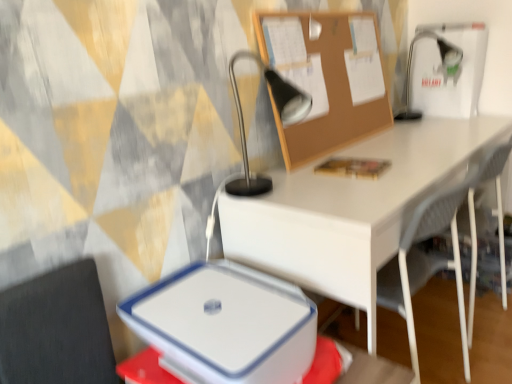
Question: Is the position of metallic silver table lamp at upper center, acting as the 1th table lamp starting from the front, less distant than that of white plastic lunch box at lower center?

Choices:
 (A) yes
 (B) no

Answer: (B)

Question: From the image's perspective, is metallic silver table lamp at upper center, acting as the 1th table lamp starting from the front, over white plastic lunch box at lower center?

Choices:
 (A) no
 (B) yes

Answer: (B)

Question: From the image's perspective, is metallic silver table lamp at upper center, the 2th table lamp in the right-to-left sequence, beneath white plastic lunch box at lower center?

Choices:
 (A) no
 (B) yes

Answer: (A)

Question: From a real-world perspective, is metallic silver table lamp at upper center, which is the 2th table lamp in back-to-front order, physically below white plastic lunch box at lower center?

Choices:
 (A) yes
 (B) no

Answer: (B)

Question: Does metallic silver table lamp at upper center, which is the 2th table lamp in back-to-front order, come behind white plastic lunch box at lower center?

Choices:
 (A) no
 (B) yes

Answer: (B)

Question: Is burlap corkboard at upper center in front of or behind white mesh chair at lower right in the image?

Choices:
 (A) behind
 (B) front

Answer: (A)

Question: From a real-world perspective, is burlap corkboard at upper center positioned above or below white mesh chair at lower right?

Choices:
 (A) above
 (B) below

Answer: (A)

Question: In terms of height, does burlap corkboard at upper center look taller or shorter compared to white mesh chair at lower right?

Choices:
 (A) tall
 (B) short

Answer: (B)

Question: Is burlap corkboard at upper center bigger or smaller than white mesh chair at lower right?

Choices:
 (A) small
 (B) big

Answer: (A)

Question: From their relative heights in the image, would you say white mesh chair at lower right is taller or shorter than metallic silver table lamp at upper right, marked as the 1th table lamp in a back-to-front arrangement?

Choices:
 (A) short
 (B) tall

Answer: (B)

Question: In the image, is white mesh chair at lower right positioned in front of or behind metallic silver table lamp at upper right, placed as the 1th table lamp when sorted from right to left?

Choices:
 (A) behind
 (B) front

Answer: (B)

Question: From the image's perspective, is white mesh chair at lower right located above or below metallic silver table lamp at upper right, the second table lamp in the left-to-right sequence?

Choices:
 (A) below
 (B) above

Answer: (A)

Question: Is white mesh chair at lower right wider or thinner than metallic silver table lamp at upper right, positioned as the second table lamp in front-to-back order?

Choices:
 (A) thin
 (B) wide

Answer: (B)

Question: Is burlap corkboard at upper center situated inside metallic silver table lamp at upper center, acting as the 1th table lamp starting from the front, or outside?

Choices:
 (A) inside
 (B) outside

Answer: (B)

Question: From a real-world perspective, is burlap corkboard at upper center physically located above or below metallic silver table lamp at upper center, which is the 2th table lamp in back-to-front order?

Choices:
 (A) below
 (B) above

Answer: (B)